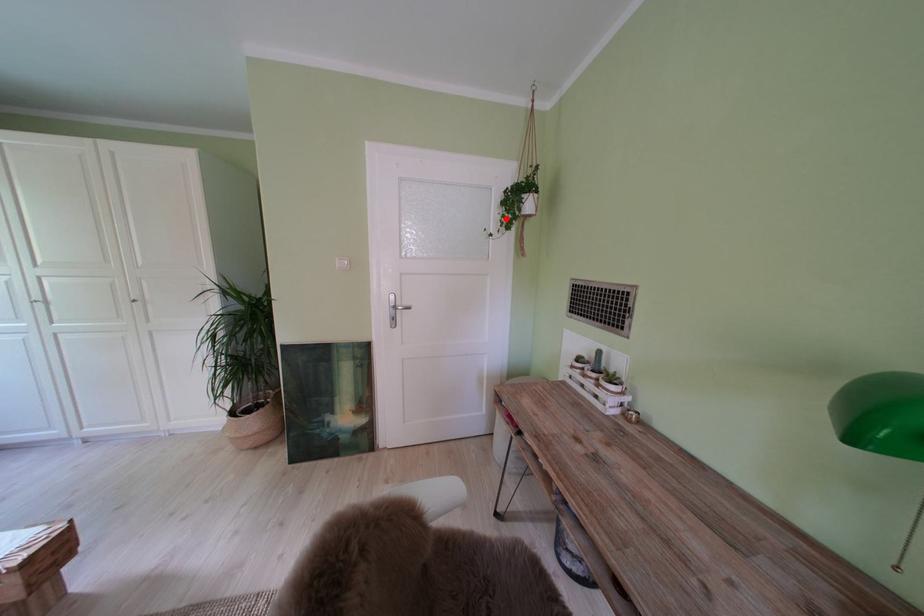
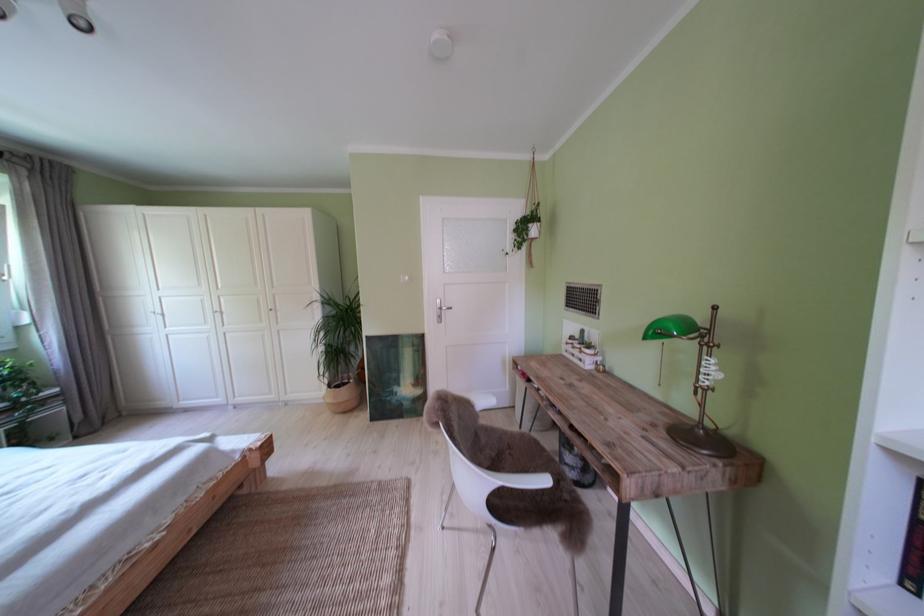
Find the pixel in the second image that matches the highlighted location in the first image.

(520, 244)